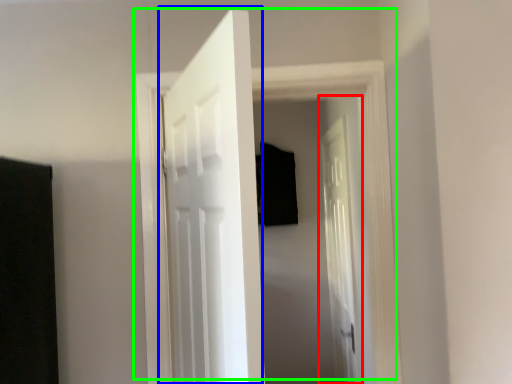
Question: Considering the real-world distances, which object is closest to door (highlighted by a red box)? door (highlighted by a blue box) or door (highlighted by a green box).

Choices:
 (A) door
 (B) door

Answer: (B)